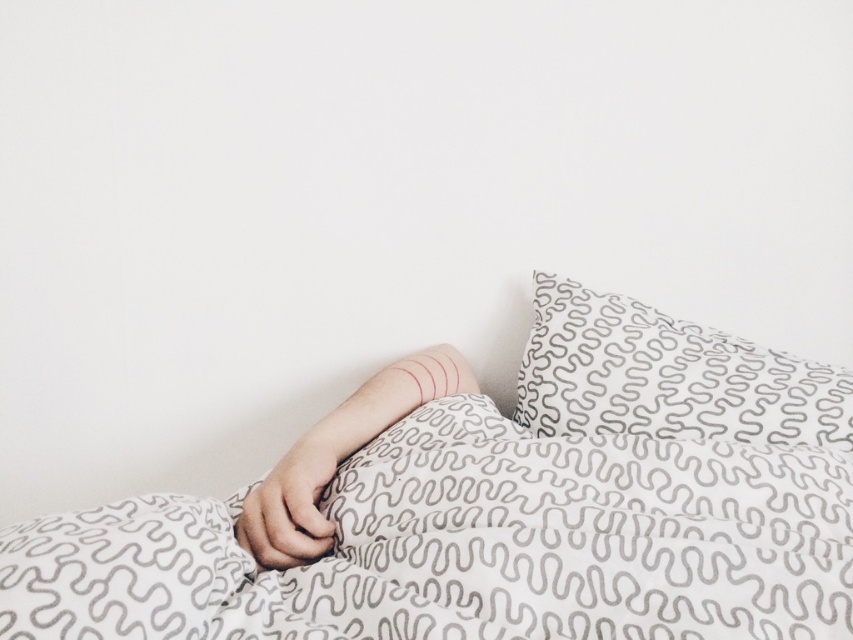
Can you confirm if white textured fabric at center is thinner than white textured pillow at upper right?

In fact, white textured fabric at center might be wider than white textured pillow at upper right.

Consider the image. Is white textured fabric at center wider than white textured pillow at upper right?

Correct, the width of white textured fabric at center exceeds that of white textured pillow at upper right.

Which is in front, point (793, 588) or point (593, 337)?

Point (793, 588)

The image size is (853, 640). Find the location of `white textured fabric at center`. white textured fabric at center is located at coordinates (496, 506).